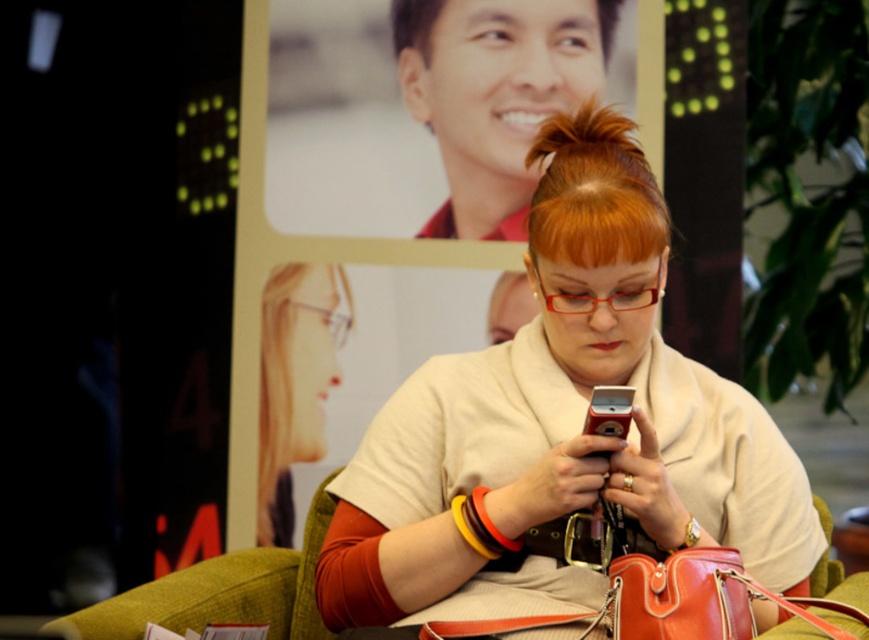
Question: Can you confirm if shiny orange handbag at lower center is smaller than metallic silver phone at center?

Choices:
 (A) yes
 (B) no

Answer: (B)

Question: Which point is farther from the camera taking this photo?

Choices:
 (A) (602, 161)
 (B) (599, 189)

Answer: (A)

Question: Estimate the real-world distances between objects in this image. Which object is farther from the clear plastic glasses at upper left?

Choices:
 (A) shiny orange hair bun at center
 (B) metallic silver phone at center

Answer: (B)

Question: Estimate the real-world distances between objects in this image. Which object is farther from the clear plastic glasses at upper left?

Choices:
 (A) shiny orange handbag at lower center
 (B) matte beige sweater at center
 (C) shiny orange hair bun at center

Answer: (A)

Question: Does clear plastic glasses at upper left have a smaller size compared to shiny orange hair bun at center?

Choices:
 (A) yes
 (B) no

Answer: (A)

Question: Is shiny orange hair bun at center below shiny orange handbag at lower center?

Choices:
 (A) no
 (B) yes

Answer: (A)